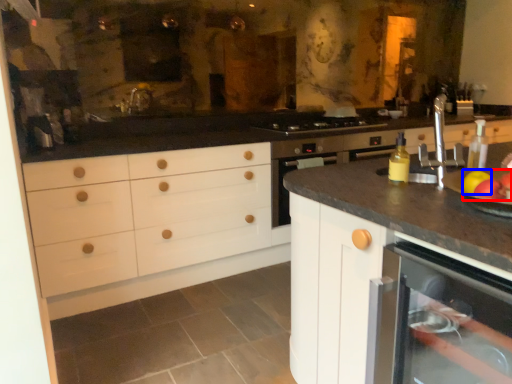
Question: Which of the following is the closest to the observer, apple (highlighted by a red box) or apple (highlighted by a blue box)?

Choices:
 (A) apple
 (B) apple

Answer: (A)